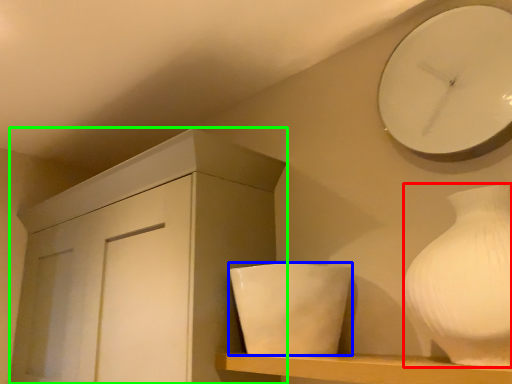
Question: Estimate the real-world distances between objects in this image. Which object is closer to vase (highlighted by a red box), ceramic (highlighted by a blue box) or cabinetry (highlighted by a green box)?

Choices:
 (A) ceramic
 (B) cabinetry

Answer: (A)